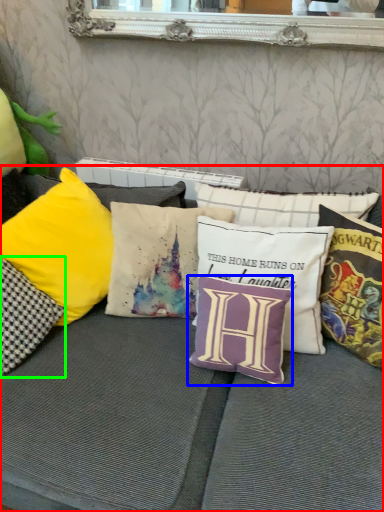
Question: Which is nearer to the studio couch (highlighted by a red box)? pillow (highlighted by a blue box) or pillow (highlighted by a green box).

Choices:
 (A) pillow
 (B) pillow

Answer: (A)